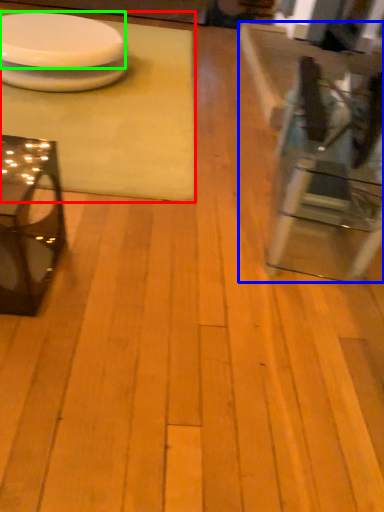
Question: Which is nearer to the table (highlighted by a red box)? table (highlighted by a blue box) or platter (highlighted by a green box).

Choices:
 (A) table
 (B) platter

Answer: (B)